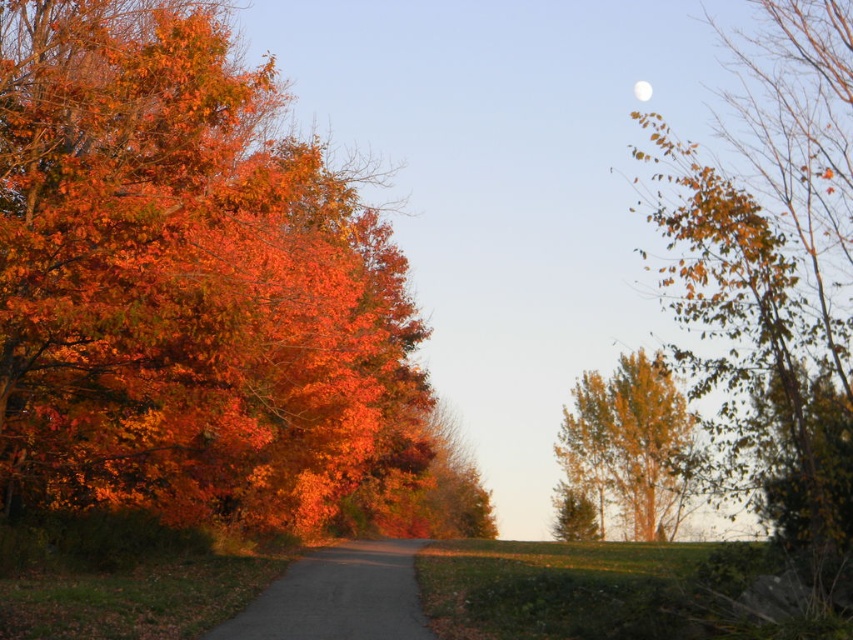
You are standing on the path in the autumn scene. You see the dull gray asphalt road at center and the white glossy moon at upper center. Which object is closer to you?

The dull gray asphalt road at center is closer to you because it is in front of the white glossy moon at upper center.

You are standing at the starting point of the path in the autumn scene. There are two points marked on the path ahead of you. One is at coordinates point (381, 364) and the other at point (653, 90). Which point is nearer to you as you begin walking along the path?

Point (381, 364) is closer to the camera than point (653, 90), so the point at coordinates point (381, 364) is nearer to you as you begin walking along the path.

You are standing at the starting point of the path in the autumn scene. You need to locate the dull gray asphalt road at center. According to the coordinates provided, where exactly would you find it?

The dull gray asphalt road at center is located at coordinates point (338, 596).